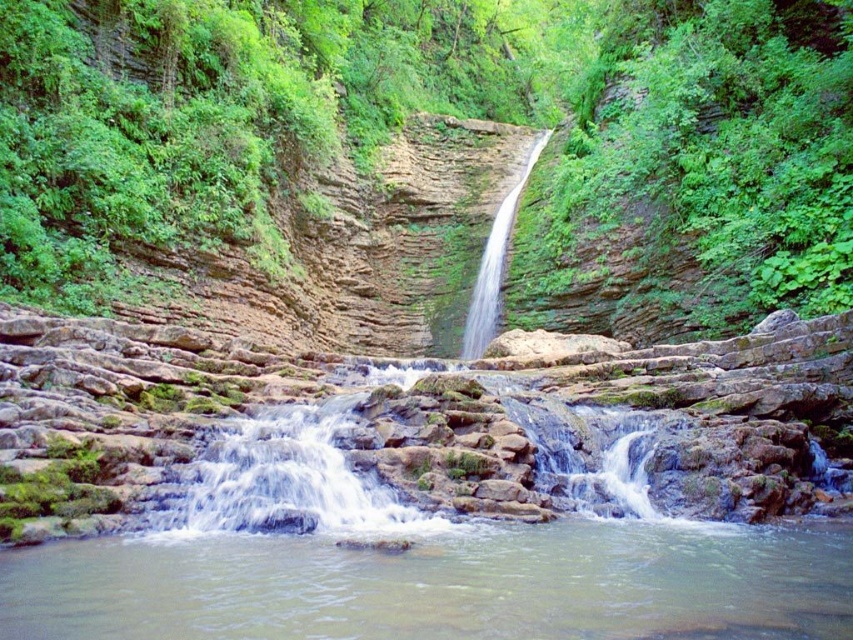
You are planning to set up a small tent in the area shown. Considering the green leafy vegetation at center and the clear water stream at center, which one would you need to move or avoid to make space for your tent?

The green leafy vegetation at center has a larger size compared to the clear water stream at center, so you would need to move or avoid the green leafy vegetation at center to make space for your tent.